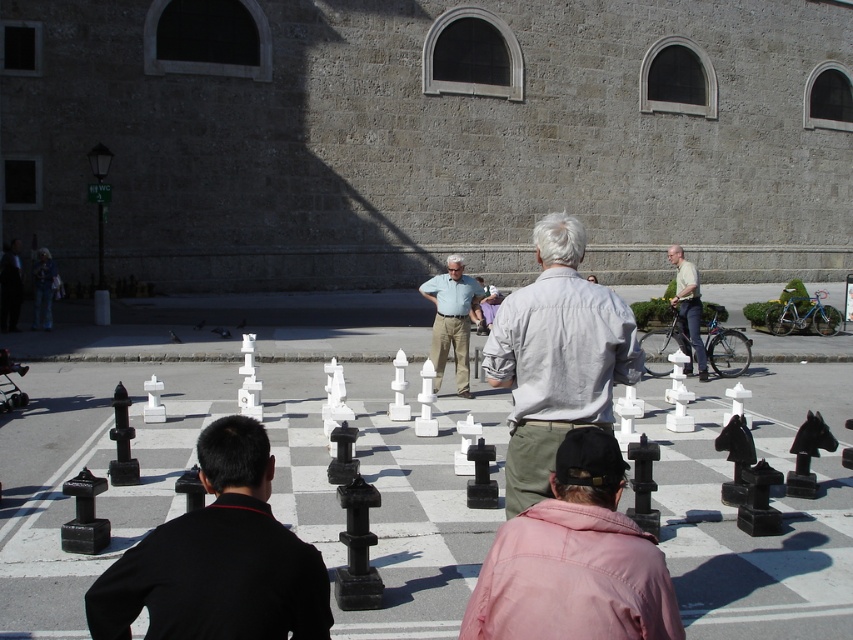
You are a photographer trying to capture both the matte pink shirt at center and the light blue shirt at center in a single shot. Which person should you adjust your camera angle to focus on first to ensure both are visible?

You should focus on the matte pink shirt at center first because it is in front of the light blue shirt at center, allowing you to frame the shot so both are visible without obstruction.

You are a photographer trying to capture the chess players. You see the matte pink shirt at center and the light gray shirt at center. Which one is more to the left?

The matte pink shirt at center is positioned on the left side of light gray shirt at center, so the matte pink shirt at center is more to the left.